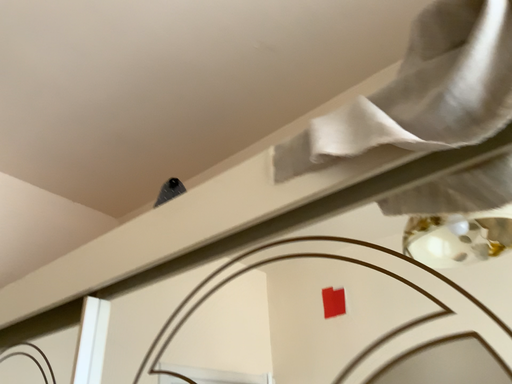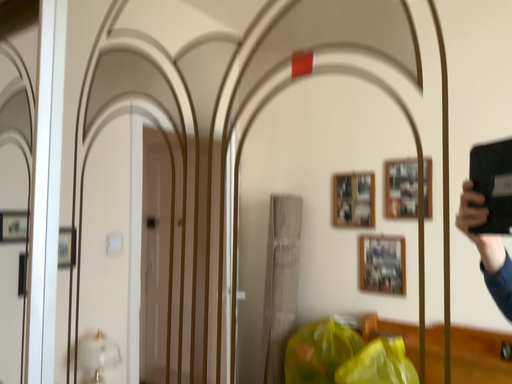
Question: Which way did the camera rotate in the video?

Choices:
 (A) rotated downward
 (B) rotated upward

Answer: (A)